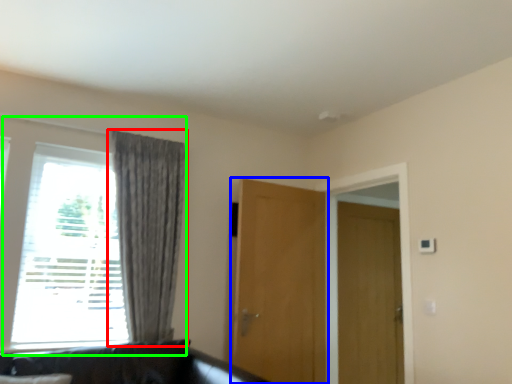
Question: Estimate the real-world distances between objects in this image. Which object is closer to curtain (highlighted by a red box), door (highlighted by a blue box) or window (highlighted by a green box)?

Choices:
 (A) door
 (B) window

Answer: (B)